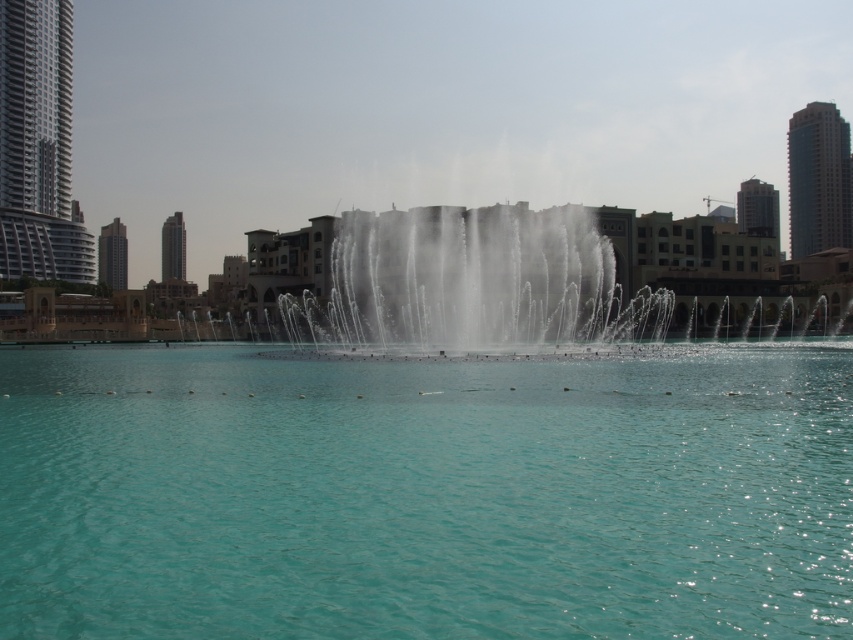
Can you confirm if clear blue water at center is wider than clear water at center?

No, clear blue water at center is not wider than clear water at center.

Does point (421, 545) lie in front of point (664, 278)?

Yes, it is.

Is point (186, 448) in front of point (262, 230)?

Yes, point (186, 448) is closer to viewer.

In order to click on clear blue water at center in this screenshot , I will do tap(425, 493).